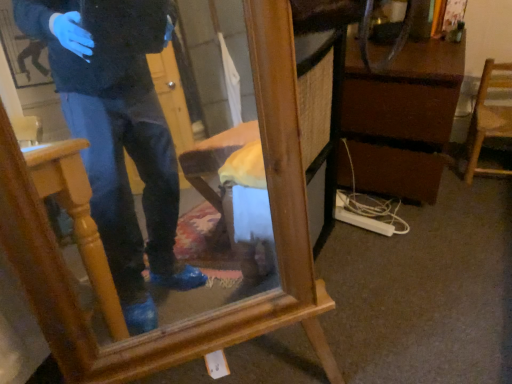
At what (x,y) coordinates should I click in order to perform the action: click on vacant space underneath wooden mirror at center (from a real-world perspective). Please return your answer as a coordinate pair (x, y). The width and height of the screenshot is (512, 384). Looking at the image, I should click on (246, 364).